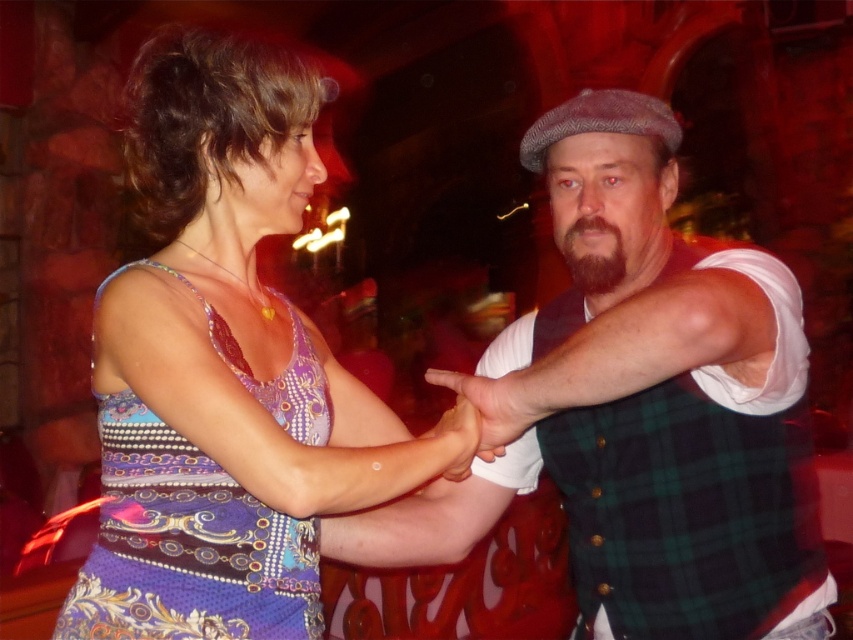
You are at a party and see two people holding hands in the center of the image. The woman is wearing a sleeveless top with swirls and dots, and the man is wearing a green plaid vest at center and has a dark brown fuzzy beard at center. Which object is positioned to the left in the image?

The green plaid vest at center is to the left of the dark brown fuzzy beard at center.

You are a photographer at a party. You need to take a photo of the green plaid vest at center and the matte black hand at center. Which object should you focus on first if you want to capture both clearly in the same frame?

The green plaid vest at center is taller than the matte black hand at center, so focus on the green plaid vest at center first to ensure both are in focus.